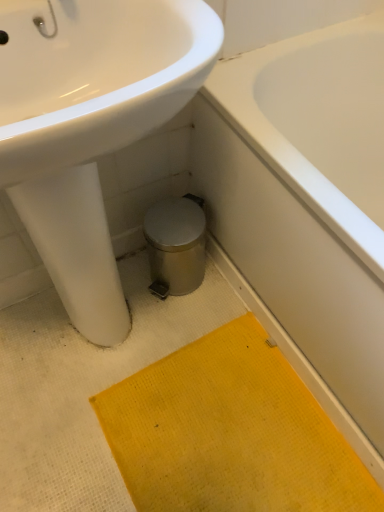
Where is `vacant area situated below white glossy sink at upper left (from a real-world perspective)`? The image size is (384, 512). vacant area situated below white glossy sink at upper left (from a real-world perspective) is located at coordinates (96, 346).